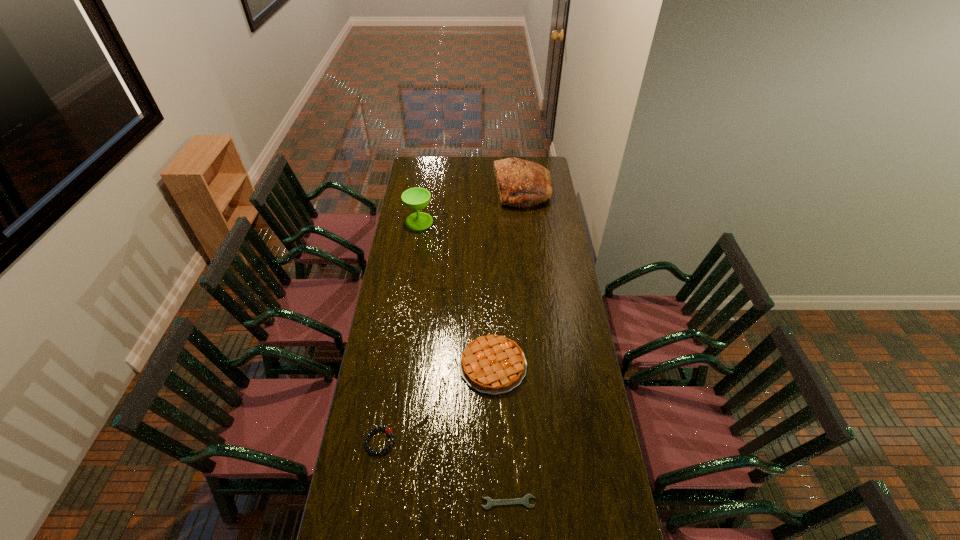
You are a GUI agent. You are given a task and a screenshot of the screen. Output one action in this format:
    pyautogui.click(x=<x>, y=<y>)
    Task: Click on the empty space that is in between the fourth farthest object and the pie
    This screenshot has height=540, width=960.
    Given the screenshot: What is the action you would take?
    pyautogui.click(x=437, y=403)

Find the location of a particular element. This screenshot has height=540, width=960. free space between the third tallest object and the wineglass is located at coordinates (456, 293).

Image resolution: width=960 pixels, height=540 pixels. Identify the location of object that is the second closest one to the fourth tallest object. (524, 501).

Locate an element on the screen. The width and height of the screenshot is (960, 540). the fourth closest object relative to the third farthest object is located at coordinates pos(521,183).

At what (x,y) coordinates should I click in order to perform the action: click on vacant space that satisfies the following two spatial constraints: 1. at the sliced front of the farthest object; 2. on the front side of the third nearest object. Please return your answer as a coordinate pair (x, y). Looking at the image, I should click on (542, 366).

The image size is (960, 540). I want to click on free location that satisfies the following two spatial constraints: 1. on the front side of the wineglass; 2. on the left side of the nearest object, so click(x=376, y=502).

I want to click on free space in the image that satisfies the following two spatial constraints: 1. on the front side of the fourth farthest object; 2. on the left side of the shortest object, so click(371, 502).

This screenshot has height=540, width=960. I want to click on vacant space that satisfies the following two spatial constraints: 1. on the back side of the bracelet; 2. on the right side of the wineglass, so click(416, 221).